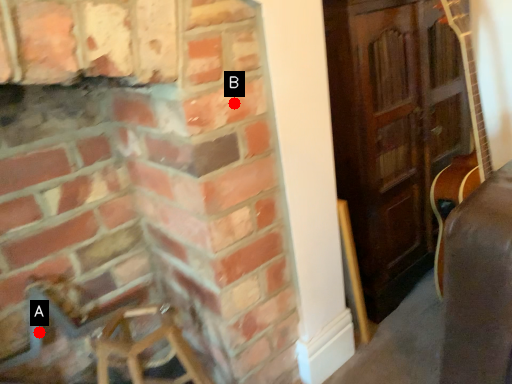
Question: Two points are circled on the image, labeled by A and B beside each circle. Which point is closer to the camera taking this photo?

Choices:
 (A) A is closer
 (B) B is closer

Answer: (B)